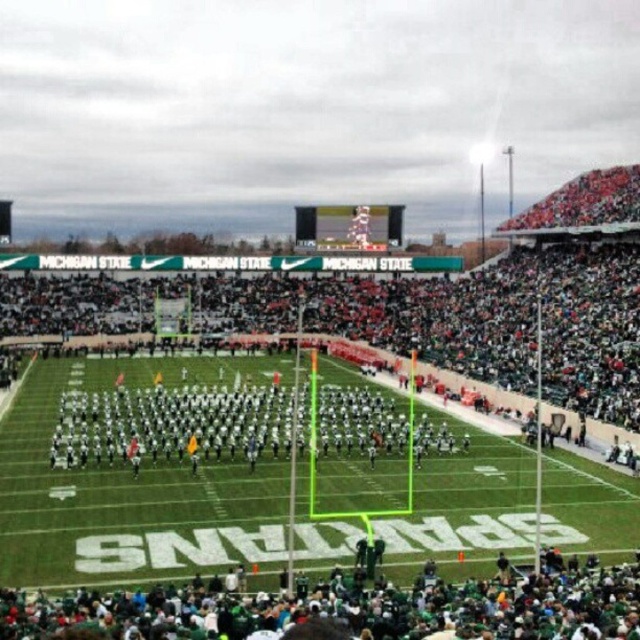
Consider the image. Between green fabric crowd at lower center and white uniformed players at center, which one appears on the right side from the viewer's perspective?

green fabric crowd at lower center

Between green fabric crowd at lower center and white uniformed players at center, which one has less height?

Standing shorter between the two is green fabric crowd at lower center.

You are a GUI agent. You are given a task and a screenshot of the screen. Output one action in this format:
    pyautogui.click(x=<x>, y=<y>)
    Task: Click on the green fabric crowd at lower center
    This screenshot has width=640, height=640.
    Given the screenshot: What is the action you would take?
    pyautogui.click(x=352, y=605)